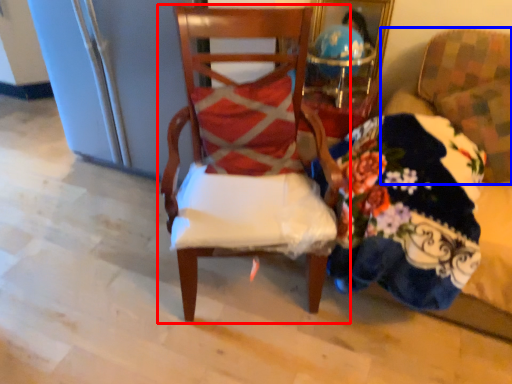
Question: Among these objects, which one is nearest to the camera, chair (highlighted by a red box) or chair (highlighted by a blue box)?

Choices:
 (A) chair
 (B) chair

Answer: (A)